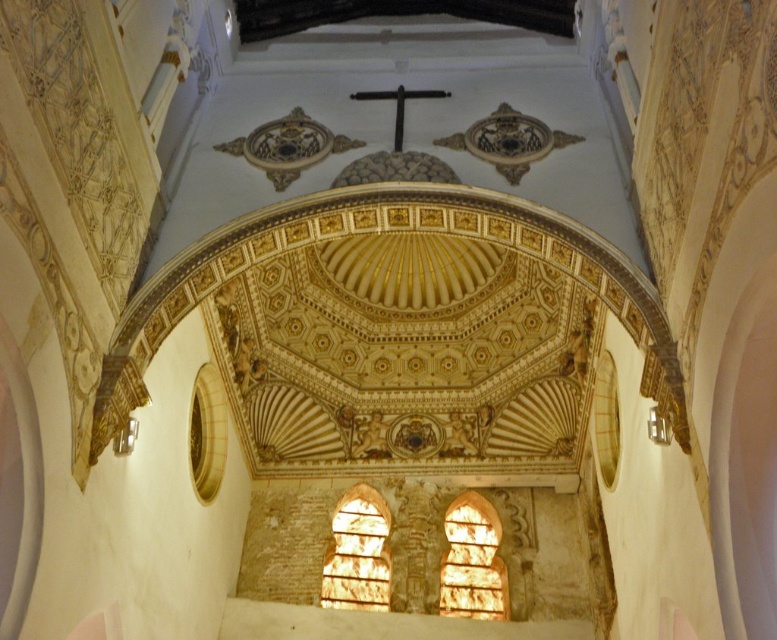
Which of these two, translucent glass window at center or translucent stone window at center, stands taller?

Standing taller between the two is translucent stone window at center.

Which of these two, translucent glass window at center or translucent stone window at center, stands shorter?

translucent glass window at center

The image size is (777, 640). What do you see at coordinates (472, 561) in the screenshot?
I see `translucent glass window at center` at bounding box center [472, 561].

The height and width of the screenshot is (640, 777). In order to click on translucent glass window at center in this screenshot , I will do `click(472, 561)`.